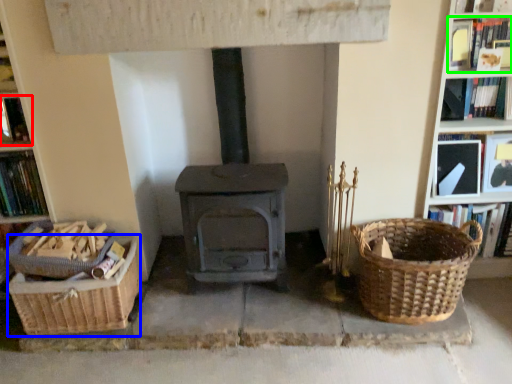
Question: Estimate the real-world distances between objects in this image. Which object is closer to book (highlighted by a red box), basket container (highlighted by a blue box) or book (highlighted by a green box)?

Choices:
 (A) basket container
 (B) book

Answer: (A)